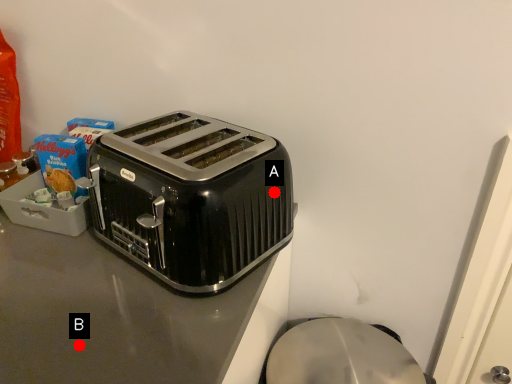
Question: Two points are circled on the image, labeled by A and B beside each circle. Which point is closer to the camera taking this photo?

Choices:
 (A) A is closer
 (B) B is closer

Answer: (B)